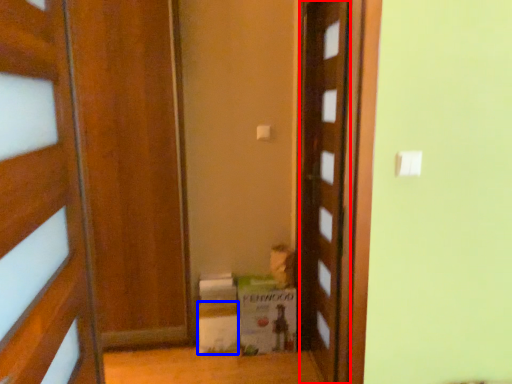
Question: Which point is closer to the camera, door (highlighted by a red box) or cardboard box (highlighted by a blue box)?

Choices:
 (A) door
 (B) cardboard box

Answer: (A)